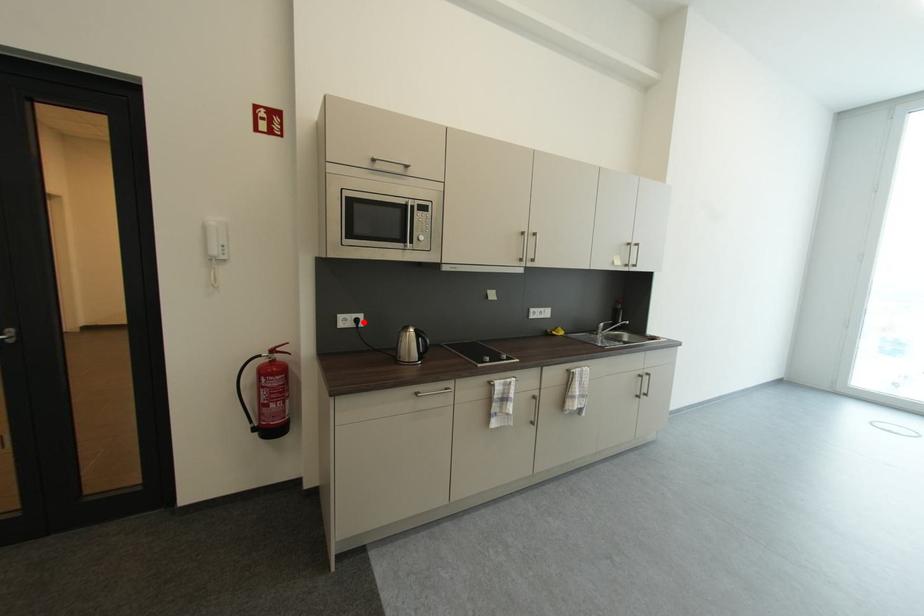
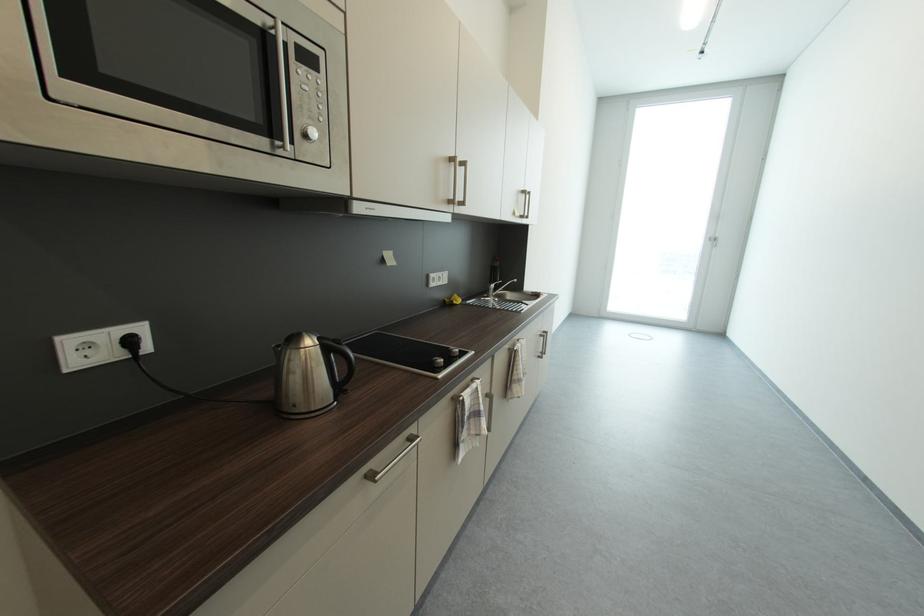
Where in the second image is the point corresponding to the highlighted location from the first image?

(137, 344)